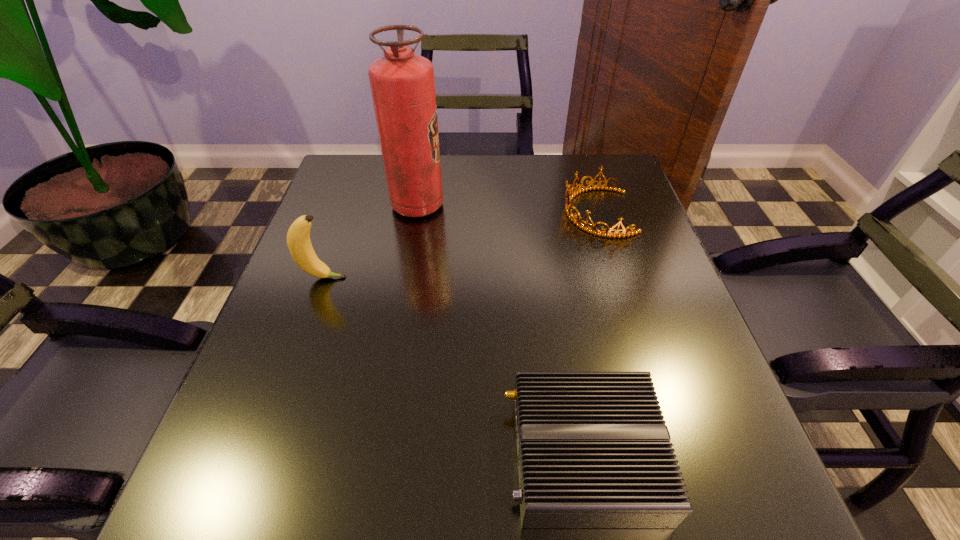
Where is `fire extinguisher`? The image size is (960, 540). fire extinguisher is located at coordinates (402, 83).

Where is `the third object from right to left`? Image resolution: width=960 pixels, height=540 pixels. the third object from right to left is located at coordinates [x=402, y=83].

Where is `banana`? The width and height of the screenshot is (960, 540). banana is located at coordinates (298, 237).

At what (x,y) coordinates should I click in order to perform the action: click on the second nearest object. Please return your answer as a coordinate pair (x, y). The height and width of the screenshot is (540, 960). Looking at the image, I should click on [298, 237].

Where is `tiara`? tiara is located at coordinates (593, 230).

The width and height of the screenshot is (960, 540). In order to click on the shortest object in this screenshot , I will do `click(593, 449)`.

Where is `the nearest object`? The width and height of the screenshot is (960, 540). the nearest object is located at coordinates (593, 449).

Identify the location of vacant region located 0.220m on the label side of the third object from right to left. (528, 206).

You are a GUI agent. You are given a task and a screenshot of the screen. Output one action in this format:
    pyautogui.click(x=<x>, y=<y>)
    Task: Click on the vacant region located 0.360m from the stem of the third farthest object
    The image size is (960, 540).
    Given the screenshot: What is the action you would take?
    pyautogui.click(x=511, y=278)

You are a GUI agent. You are given a task and a screenshot of the screen. Output one action in this format:
    pyautogui.click(x=<x>, y=<y>)
    Task: Click on the vacant space located 0.350m on the front-facing side of the tiara
    This screenshot has width=960, height=540.
    Given the screenshot: What is the action you would take?
    pyautogui.click(x=424, y=212)